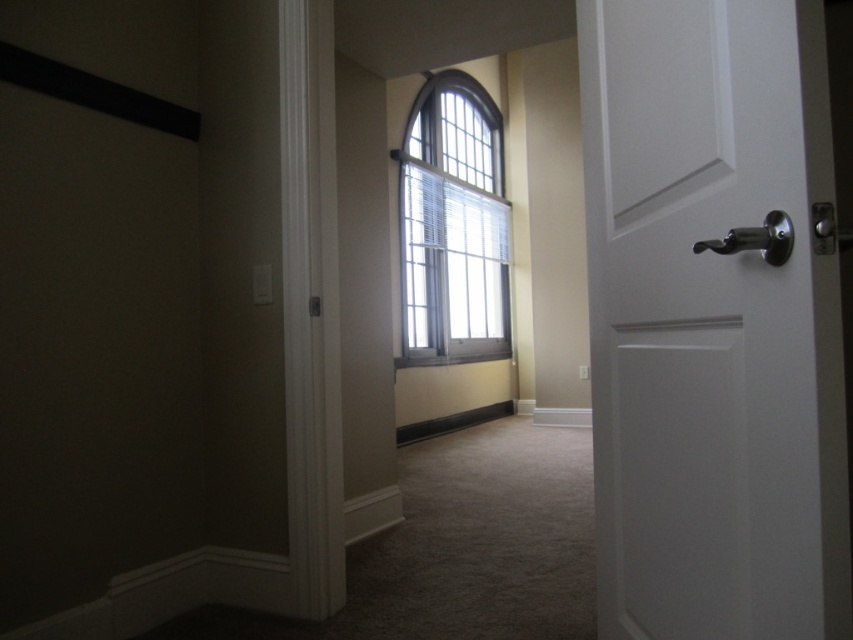
Does white matte door at right have a greater width compared to clear glass window at center?

Incorrect, white matte door at right's width does not surpass clear glass window at center's.

Between point (618, 182) and point (454, 163), which one is positioned in front?

Positioned in front is point (618, 182).

Locate an element on the screen. white matte door at right is located at coordinates (714, 321).